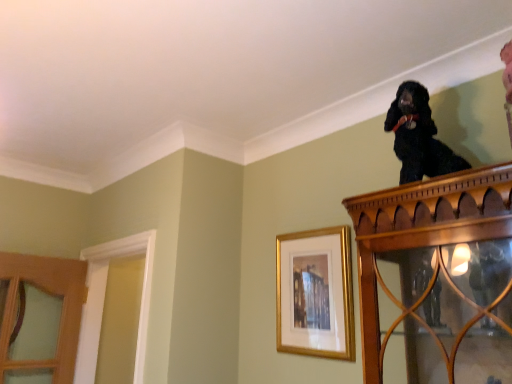
Question: Is white wood door frame at left bigger than black silky dog at upper right?

Choices:
 (A) yes
 (B) no

Answer: (A)

Question: Can you confirm if white wood door frame at left is positioned to the right of black silky dog at upper right?

Choices:
 (A) no
 (B) yes

Answer: (A)

Question: Does white wood door frame at left appear on the left side of black silky dog at upper right?

Choices:
 (A) yes
 (B) no

Answer: (A)

Question: Is black silky dog at upper right surrounded by white wood door frame at left?

Choices:
 (A) no
 (B) yes

Answer: (A)

Question: From a real-world perspective, is white wood door frame at left on top of black silky dog at upper right?

Choices:
 (A) no
 (B) yes

Answer: (A)

Question: Considering the relative positions of white wood door frame at left and black silky dog at upper right in the image provided, is white wood door frame at left behind black silky dog at upper right?

Choices:
 (A) yes
 (B) no

Answer: (A)

Question: Is white wood door frame at left closer to the viewer compared to gold framed picture at upper center?

Choices:
 (A) no
 (B) yes

Answer: (A)

Question: Does white wood door frame at left have a greater height compared to gold framed picture at upper center?

Choices:
 (A) yes
 (B) no

Answer: (A)

Question: Is white wood door frame at left aimed at gold framed picture at upper center?

Choices:
 (A) yes
 (B) no

Answer: (B)

Question: Can you confirm if white wood door frame at left is smaller than gold framed picture at upper center?

Choices:
 (A) no
 (B) yes

Answer: (A)

Question: Does white wood door frame at left have a larger size compared to gold framed picture at upper center?

Choices:
 (A) no
 (B) yes

Answer: (B)

Question: Is white wood door frame at left far from gold framed picture at upper center?

Choices:
 (A) no
 (B) yes

Answer: (A)

Question: Is black silky dog at upper right at the back of gold framed picture at upper center?

Choices:
 (A) yes
 (B) no

Answer: (B)